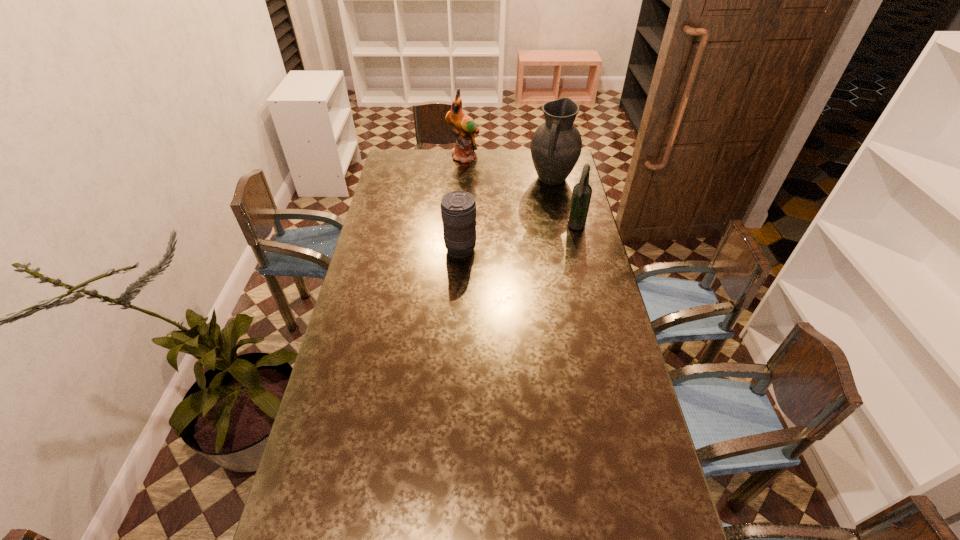
You are a GUI agent. You are given a task and a screenshot of the screen. Output one action in this format:
    pyautogui.click(x=<x>, y=<y>)
    Task: Click on the nearest object
    The height and width of the screenshot is (540, 960).
    Given the screenshot: What is the action you would take?
    pyautogui.click(x=458, y=208)

Find the location of a particular element. This screenshot has height=540, width=960. the shortest object is located at coordinates (458, 208).

Identify the location of beer bottle. The width and height of the screenshot is (960, 540). (582, 191).

At what (x,y) coordinates should I click in order to perform the action: click on the third tallest object. Please return your answer as a coordinate pair (x, y). The height and width of the screenshot is (540, 960). Looking at the image, I should click on (582, 191).

This screenshot has width=960, height=540. In order to click on pitcher in this screenshot , I will do `click(556, 145)`.

You are a GUI agent. You are given a task and a screenshot of the screen. Output one action in this format:
    pyautogui.click(x=<x>, y=<y>)
    Task: Click on the parrot
    The width and height of the screenshot is (960, 540).
    Given the screenshot: What is the action you would take?
    pyautogui.click(x=465, y=127)

Identify the location of vacant space located on the side of the nearest object where the control switches are located. (364, 249).

You are a GUI agent. You are given a task and a screenshot of the screen. Output one action in this format:
    pyautogui.click(x=<x>, y=<y>)
    Task: Click on the vacant space located 0.240m on the side of the nearest object where the control switches are located
    This screenshot has height=540, width=960.
    Given the screenshot: What is the action you would take?
    pyautogui.click(x=384, y=249)

Identify the location of free location located on the side of the nearest object where the control switches are located. (411, 249).

You are a GUI agent. You are given a task and a screenshot of the screen. Output one action in this format:
    pyautogui.click(x=<x>, y=<y>)
    Task: Click on the blank space located 0.160m on the front of the beer bottle
    
    Given the screenshot: What is the action you would take?
    pyautogui.click(x=585, y=261)